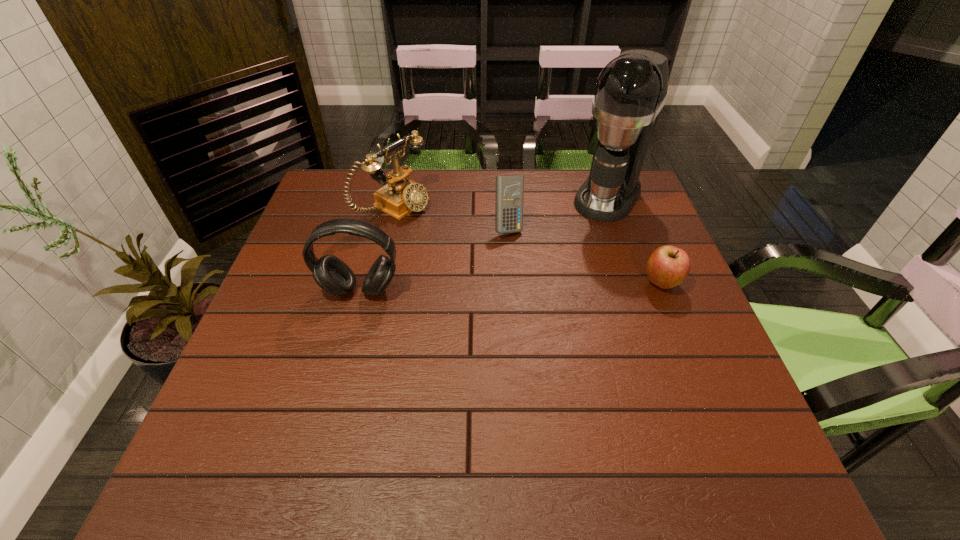
Locate an element on the screen. The height and width of the screenshot is (540, 960). empty space that is in between the headset and the telephone is located at coordinates (377, 249).

Where is `vacant area that lies between the headset and the calculator`? This screenshot has width=960, height=540. vacant area that lies between the headset and the calculator is located at coordinates (434, 259).

Identify the location of free area in between the third object from right to left and the telephone. The width and height of the screenshot is (960, 540). (451, 217).

Find the location of `blank region between the tallest object and the headset`. blank region between the tallest object and the headset is located at coordinates (484, 244).

You are a GUI agent. You are given a task and a screenshot of the screen. Output one action in this format:
    pyautogui.click(x=<x>, y=<y>)
    Task: Click on the empty space that is in between the shortest object and the telephone
    This screenshot has width=960, height=540.
    Given the screenshot: What is the action you would take?
    pyautogui.click(x=527, y=245)

Locate an element on the screen. The width and height of the screenshot is (960, 540). vacant space that is in between the shortest object and the tallest object is located at coordinates (635, 240).

Locate which object is the second closest to the tallest object. Please provide its 2D coordinates. Your answer should be formatted as a tuple, i.e. [(x, y)], where the tuple contains the x and y coordinates of a point satisfying the conditions above.

[(667, 266)]

Find the location of a particular element. the fourth closest object to the fourth tallest object is located at coordinates (667, 266).

You are a GUI agent. You are given a task and a screenshot of the screen. Output one action in this format:
    pyautogui.click(x=<x>, y=<y>)
    Task: Click on the vacant area that satisfies the following two spatial constraints: 1. on the front side of the shortest object; 2. on the left side of the tallest object
    Image resolution: width=960 pixels, height=540 pixels.
    Given the screenshot: What is the action you would take?
    pyautogui.click(x=638, y=283)

Find the location of a particular element. free space that satisfies the following two spatial constraints: 1. on the front side of the telephone; 2. on the left side of the apple is located at coordinates (376, 283).